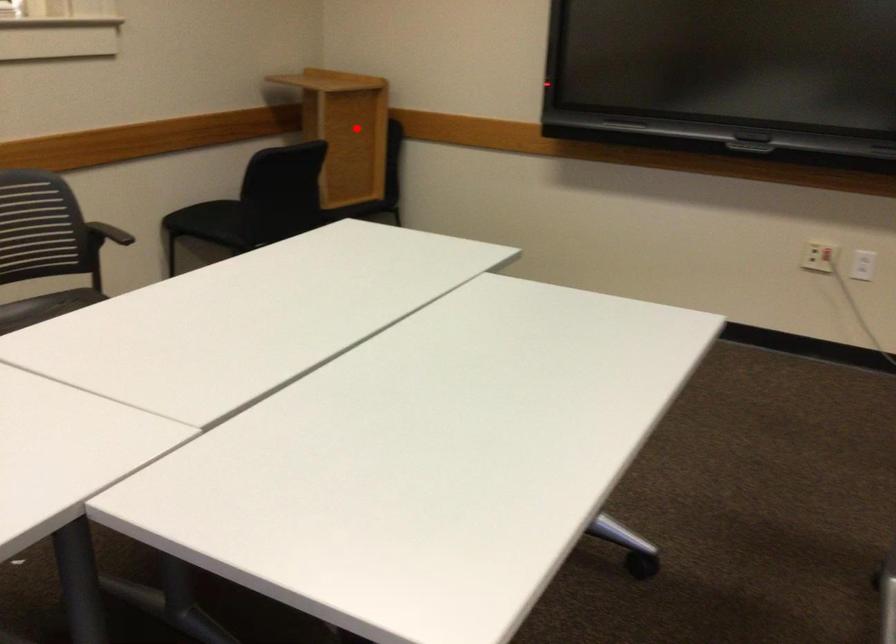
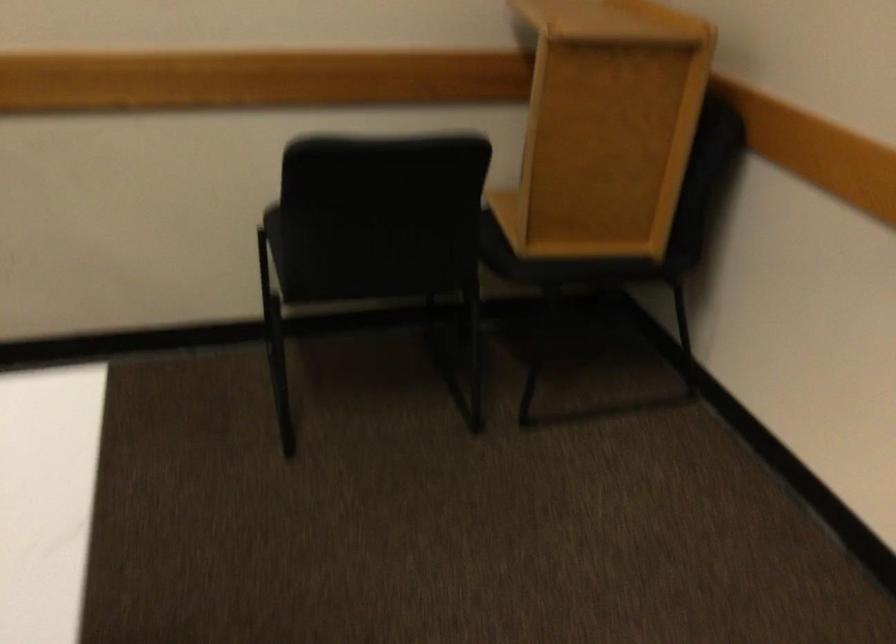
Question: I am providing you with two images of the same scene from different viewpoints. Image1 has a red point marked. In image2, the corresponding 3D location appears at what relative position? Reply with the corresponding letter.

Choices:
 (A) Closer
 (B) Farther

Answer: (A)